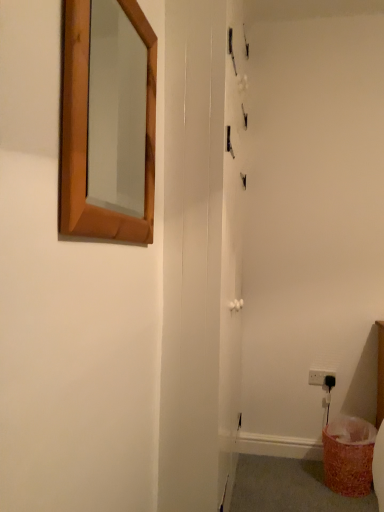
Question: Can you confirm if orange textured laundry basket at lower right is wider than wooden-framed mirror at upper left?

Choices:
 (A) yes
 (B) no

Answer: (A)

Question: Is orange textured laundry basket at lower right outside wooden-framed mirror at upper left?

Choices:
 (A) yes
 (B) no

Answer: (A)

Question: Does orange textured laundry basket at lower right appear on the right side of wooden-framed mirror at upper left?

Choices:
 (A) no
 (B) yes

Answer: (B)

Question: Does orange textured laundry basket at lower right have a greater height compared to wooden-framed mirror at upper left?

Choices:
 (A) no
 (B) yes

Answer: (A)

Question: Is the position of orange textured laundry basket at lower right less distant than that of wooden-framed mirror at upper left?

Choices:
 (A) no
 (B) yes

Answer: (A)

Question: From the image's perspective, relative to orange textured laundry basket at lower right, is white glossy screen door at center above or below?

Choices:
 (A) below
 (B) above

Answer: (B)

Question: Considering the positions of white glossy screen door at center and orange textured laundry basket at lower right in the image, is white glossy screen door at center wider or thinner than orange textured laundry basket at lower right?

Choices:
 (A) thin
 (B) wide

Answer: (A)

Question: Does point (170, 488) appear closer or farther from the camera than point (344, 428)?

Choices:
 (A) farther
 (B) closer

Answer: (B)

Question: From a real-world perspective, is white glossy screen door at center physically located above or below orange textured laundry basket at lower right?

Choices:
 (A) below
 (B) above

Answer: (B)

Question: From the image's perspective, is orange textured laundry basket at lower right positioned above or below wooden-framed mirror at upper left?

Choices:
 (A) above
 (B) below

Answer: (B)

Question: Relative to wooden-framed mirror at upper left, is orange textured laundry basket at lower right in front or behind?

Choices:
 (A) behind
 (B) front

Answer: (A)

Question: Considering the positions of orange textured laundry basket at lower right and wooden-framed mirror at upper left in the image, is orange textured laundry basket at lower right bigger or smaller than wooden-framed mirror at upper left?

Choices:
 (A) big
 (B) small

Answer: (A)

Question: From a real-world perspective, relative to wooden-framed mirror at upper left, is orange textured laundry basket at lower right vertically above or below?

Choices:
 (A) below
 (B) above

Answer: (A)

Question: Choose the correct answer: Is white plastic electric outlet at lower right inside orange textured laundry basket at lower right or outside it?

Choices:
 (A) inside
 (B) outside

Answer: (B)

Question: Looking at the image, does white plastic electric outlet at lower right seem bigger or smaller compared to orange textured laundry basket at lower right?

Choices:
 (A) small
 (B) big

Answer: (A)